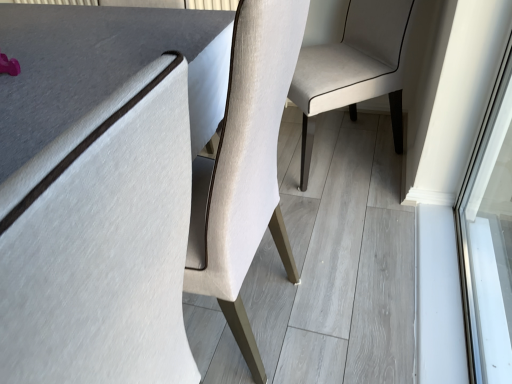
Identify the location of vacant area that is in front of light beige fabric chair at center. (362, 217).